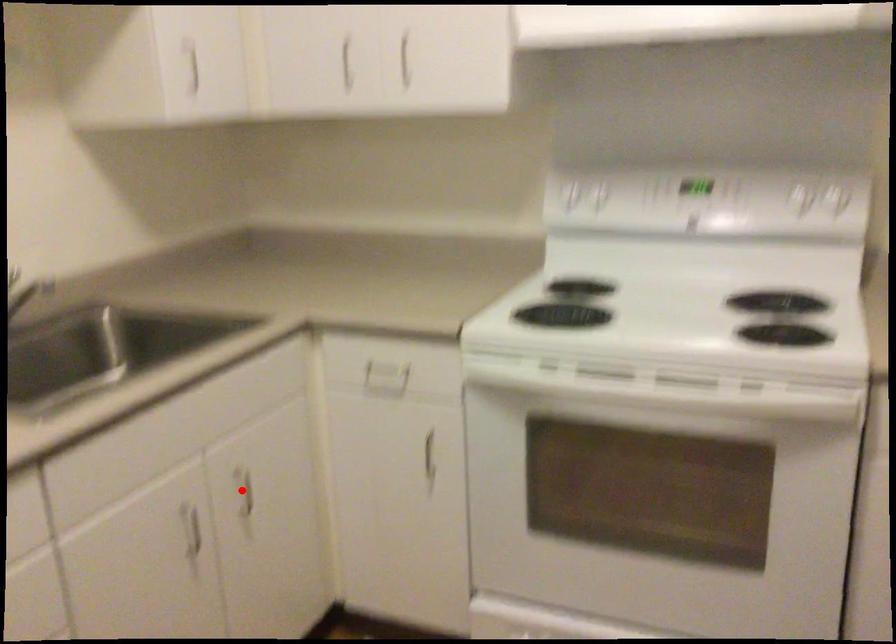
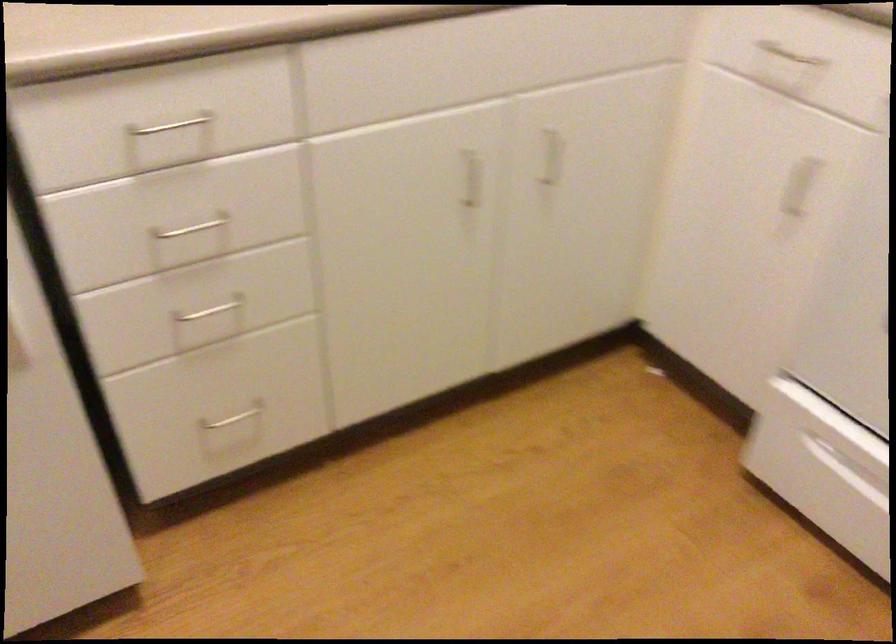
The point at the highlighted location is marked in the first image. Where is the corresponding point in the second image?

(552, 156)